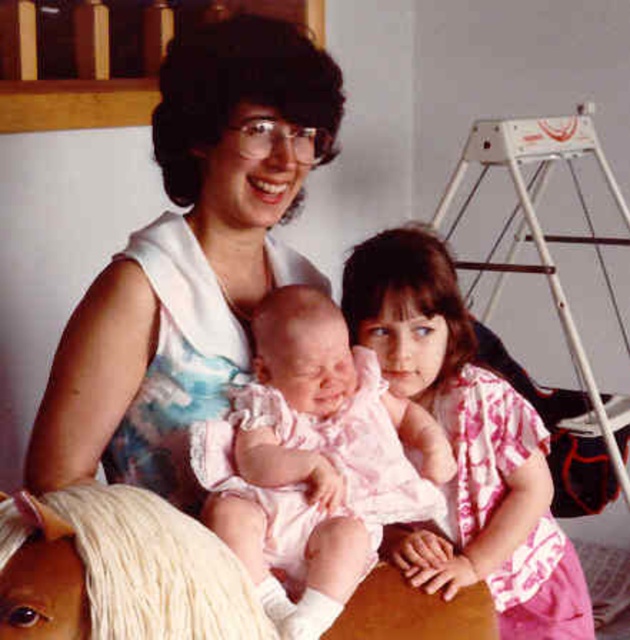
Question: Considering the real-world distances, which object is farthest from the pink satin dress at center?

Choices:
 (A) white plush horse at lower left
 (B) pink floral shirt at center

Answer: (A)

Question: Which object is the closest to the white plush horse at lower left?

Choices:
 (A) pink satin dress at center
 (B) pink floral shirt at center

Answer: (A)

Question: Is pink satin dress at center behind white plush horse at lower left?

Choices:
 (A) yes
 (B) no

Answer: (A)

Question: Can you confirm if pink satin dress at center is smaller than pink floral shirt at center?

Choices:
 (A) yes
 (B) no

Answer: (A)

Question: Can you confirm if pink satin dress at center is positioned to the left of white plush horse at lower left?

Choices:
 (A) no
 (B) yes

Answer: (A)

Question: Which point is farther to the camera?

Choices:
 (A) pink satin dress at center
 (B) white plush horse at lower left

Answer: (A)